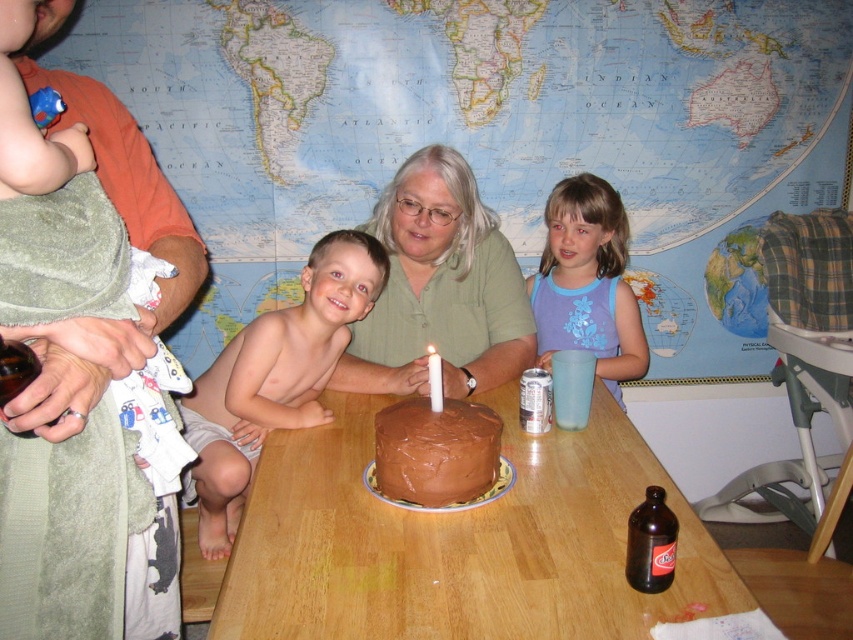
You are a guest at the gathering and need to wipe your hands. The soft cotton towel at upper left and the blue cotton shirt at upper right are both within reach. Which one is closer to your right hand if you are facing the table?

The blue cotton shirt at upper right is closer to your right hand because it is positioned to the right of the soft cotton towel at upper left.

You are a guest at the family gathering and need to clean up a spill on the table. The nearest clean towel is the soft cotton towel at upper left. Can you reach it without leaving your seat?

The soft cotton towel at upper left is located at point (77, 534), so it is within reach from your seat if you can extend your arm that far.

You are a guest at the gathering and need to reach for the cake. Which object, the soft cotton towel at upper left or the smooth skin boy at center, is closer to you?

The smooth skin boy at center is closer to you because the soft cotton towel at upper left is much taller, meaning it is further away.